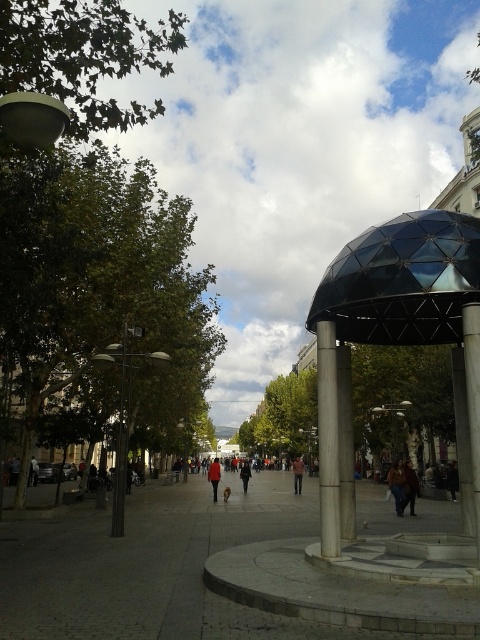
You are a delivery person carrying a brown leather jacket at center and need to pass through a transparent glass dome at center. Can you fit through the entrance of the dome while holding the jacket?

The transparent glass dome at center is wider than the brown leather jacket at center, so you can fit through the entrance while holding the jacket.